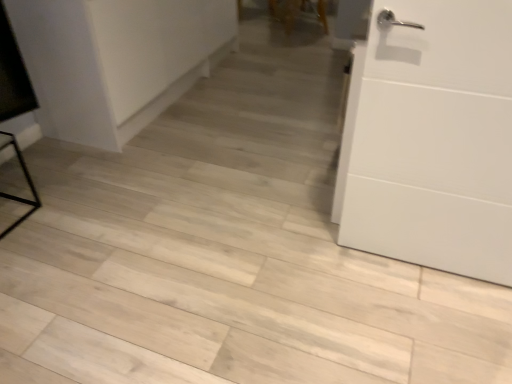
Question: Is white matte door at right shorter than wooden chair at upper center?

Choices:
 (A) no
 (B) yes

Answer: (A)

Question: From a real-world perspective, is white matte door at right beneath wooden chair at upper center?

Choices:
 (A) yes
 (B) no

Answer: (B)

Question: Can you confirm if white matte door at right is taller than wooden chair at upper center?

Choices:
 (A) no
 (B) yes

Answer: (B)

Question: Is white matte door at right oriented towards wooden chair at upper center?

Choices:
 (A) yes
 (B) no

Answer: (B)

Question: Does white matte door at right have a lesser width compared to wooden chair at upper center?

Choices:
 (A) yes
 (B) no

Answer: (A)

Question: Considering their positions, is wooden chair at upper center located in front of or behind white matte cabinet at upper left?

Choices:
 (A) behind
 (B) front

Answer: (A)

Question: Is point (291, 21) positioned closer to the camera than point (198, 31)?

Choices:
 (A) closer
 (B) farther

Answer: (B)

Question: Considering the positions of wooden chair at upper center and white matte cabinet at upper left in the image, is wooden chair at upper center taller or shorter than white matte cabinet at upper left?

Choices:
 (A) short
 (B) tall

Answer: (A)

Question: Looking at the image, does wooden chair at upper center seem bigger or smaller compared to white matte cabinet at upper left?

Choices:
 (A) small
 (B) big

Answer: (A)

Question: Considering the relative positions of white matte door at right and white matte cabinet at upper left in the image provided, is white matte door at right to the left or to the right of white matte cabinet at upper left?

Choices:
 (A) right
 (B) left

Answer: (A)

Question: In terms of height, does white matte door at right look taller or shorter compared to white matte cabinet at upper left?

Choices:
 (A) short
 (B) tall

Answer: (B)

Question: Which is correct: white matte door at right is inside white matte cabinet at upper left, or outside of it?

Choices:
 (A) outside
 (B) inside

Answer: (A)

Question: From a real-world perspective, is white matte door at right physically located above or below white matte cabinet at upper left?

Choices:
 (A) below
 (B) above

Answer: (B)

Question: Is white matte cabinet at upper left wider or thinner than white matte door at right?

Choices:
 (A) wide
 (B) thin

Answer: (A)

Question: Considering their positions, is white matte cabinet at upper left located in front of or behind white matte door at right?

Choices:
 (A) front
 (B) behind

Answer: (B)